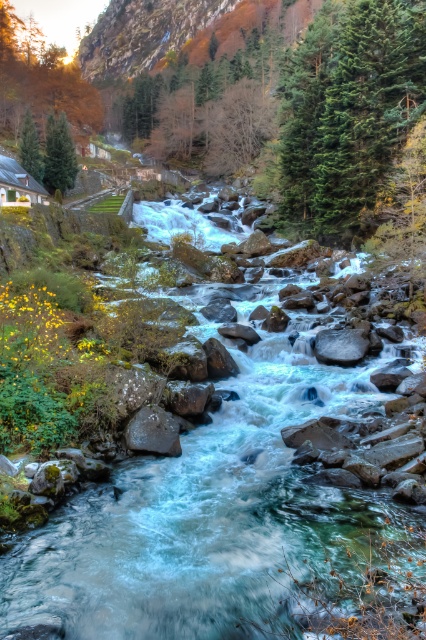
You are an environmental scientist assessing the river ecosystem. You observe the clear water at center and the smooth gray rock at center. Which object occupies a greater area in the scene?

The clear water at center is larger in size than the smooth gray rock at center, so the clear water at center occupies a greater area in the scene.

You are a kayaker planning to navigate through the river shown in the image. You need to pass between the clear water at center and the smooth gray rock at center. Your kayak is 2 meters wide. Is there enough space for your kayak to pass safely between them?

The distance between the clear water at center and the smooth gray rock at center is 4.86 meters. Since your kayak is only 2 meters wide, there is sufficient space for it to pass safely between them.